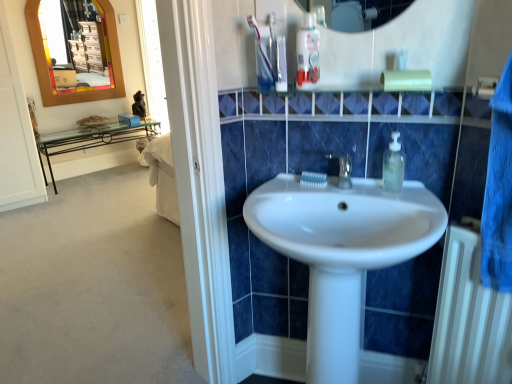
Question: Considering the relative positions of clear plastic mouthwash at upper center and white glossy toothpaste at upper center, which is the 2th toothpaste from bottom to top, in the image provided, is clear plastic mouthwash at upper center to the left of white glossy toothpaste at upper center, which is the 2th toothpaste from bottom to top, from the viewer's perspective?

Choices:
 (A) no
 (B) yes

Answer: (A)

Question: Can you confirm if clear plastic mouthwash at upper center is taller than white glossy toothpaste at upper center, placed as the first toothpaste when sorted from front to back?

Choices:
 (A) no
 (B) yes

Answer: (B)

Question: From a real-world perspective, is clear plastic mouthwash at upper center located higher than white glossy toothpaste at upper center, placed as the first toothpaste when sorted from front to back?

Choices:
 (A) no
 (B) yes

Answer: (B)

Question: Is clear plastic mouthwash at upper center completely or partially outside of white glossy toothpaste at upper center, which is the second toothpaste in right-to-left order?

Choices:
 (A) no
 (B) yes

Answer: (B)

Question: From a real-world perspective, is clear plastic mouthwash at upper center beneath white glossy toothpaste at upper center, which is the second toothpaste in right-to-left order?

Choices:
 (A) yes
 (B) no

Answer: (B)

Question: From the image's perspective, is clear plastic mouthwash at upper center on top of white glossy toothpaste at upper center, the first toothpaste in the top-to-bottom sequence?

Choices:
 (A) yes
 (B) no

Answer: (B)

Question: Considering the relative sizes of clear plastic mouthwash at upper center and white glossy toothpaste at center, acting as the first toothpaste starting from the back, in the image provided, is clear plastic mouthwash at upper center taller than white glossy toothpaste at center, acting as the first toothpaste starting from the back,?

Choices:
 (A) no
 (B) yes

Answer: (B)

Question: Can you confirm if clear plastic mouthwash at upper center is bigger than white glossy toothpaste at center, which is the second toothpaste from front to back?

Choices:
 (A) no
 (B) yes

Answer: (B)

Question: Can you confirm if clear plastic mouthwash at upper center is thinner than white glossy toothpaste at center, acting as the first toothpaste starting from the back?

Choices:
 (A) no
 (B) yes

Answer: (B)

Question: Is clear plastic mouthwash at upper center wider than white glossy toothpaste at center, the second toothpaste viewed from the left?

Choices:
 (A) no
 (B) yes

Answer: (A)

Question: Does clear plastic mouthwash at upper center touch white glossy toothpaste at center, the first toothpaste positioned from the right?

Choices:
 (A) yes
 (B) no

Answer: (B)

Question: Is clear plastic mouthwash at upper center far from white glossy toothpaste at center, positioned as the second toothpaste in top-to-bottom order?

Choices:
 (A) no
 (B) yes

Answer: (A)

Question: Is clear plastic soap dispenser at upper right wider than white glossy sink at center?

Choices:
 (A) no
 (B) yes

Answer: (A)